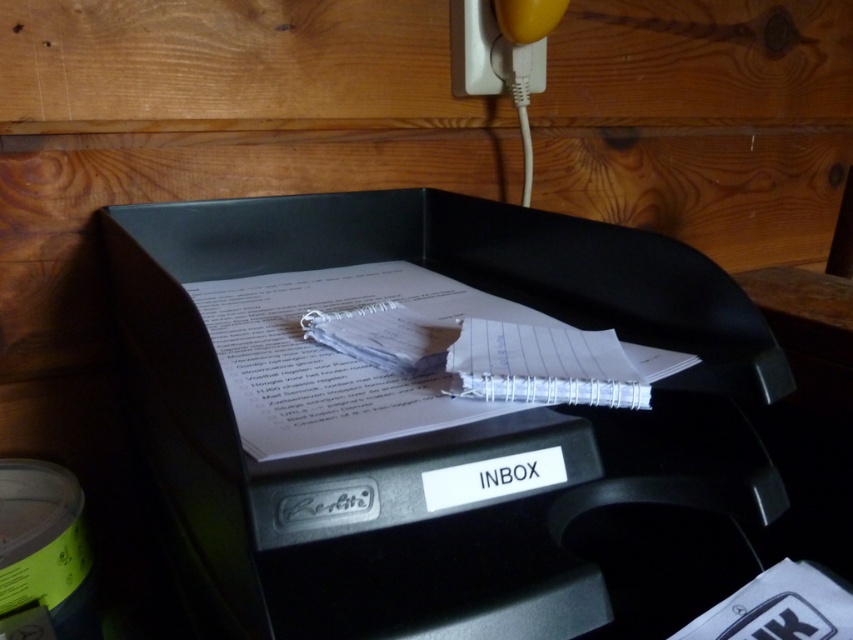
You are organizing your desk and need to place a new sticky note. You see the white lined paper at center and the yellow rubber at upper right. Where should you place the sticky note to be to the right of both objects?

You should place the sticky note to the right of both the white lined paper at center and the yellow rubber at upper right since the white lined paper at center is to the left of the yellow rubber at upper right.

You are organizing your desk and notice the black plastic inbox at center and the yellow rubber at upper right. Which object is positioned higher on the desk?

The yellow rubber at upper right is positioned higher on the desk than the black plastic inbox at center.